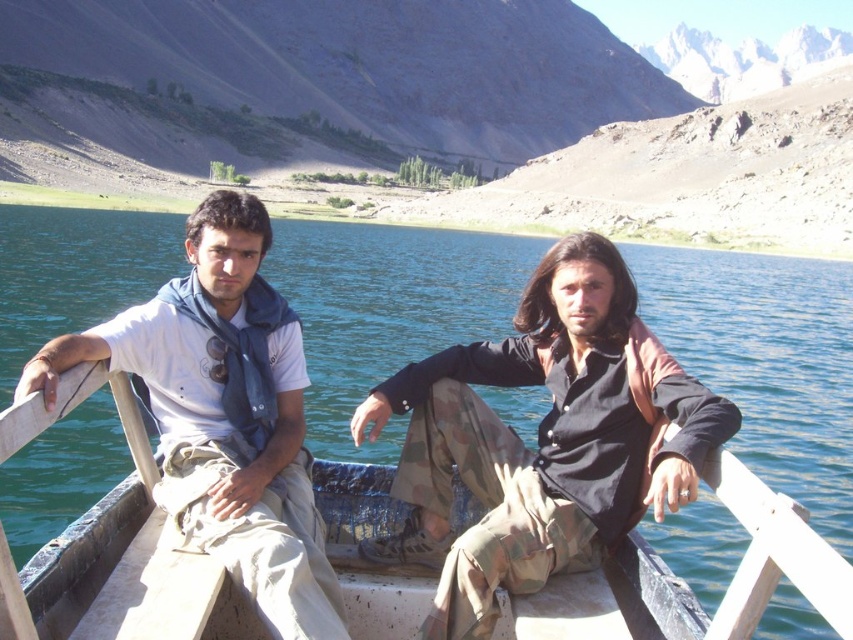
Question: Which point is farther from the camera taking this photo?

Choices:
 (A) (252, 358)
 (B) (392, 486)
 (C) (312, 308)

Answer: (C)

Question: Does clear blue water at center have a lesser width compared to white cotton shirt at left?

Choices:
 (A) no
 (B) yes

Answer: (A)

Question: Which object is closer to the camera taking this photo?

Choices:
 (A) camouflage pants at center
 (B) white cotton shirt at left
 (C) clear blue water at center

Answer: (B)

Question: Does clear blue water at center have a lesser width compared to camouflage pants at center?

Choices:
 (A) no
 (B) yes

Answer: (A)

Question: Is clear blue water at center in front of camouflage pants at center?

Choices:
 (A) yes
 (B) no

Answer: (B)

Question: Which is farther from the clear blue water at center?

Choices:
 (A) white cotton shirt at left
 (B) camouflage pants at center

Answer: (A)